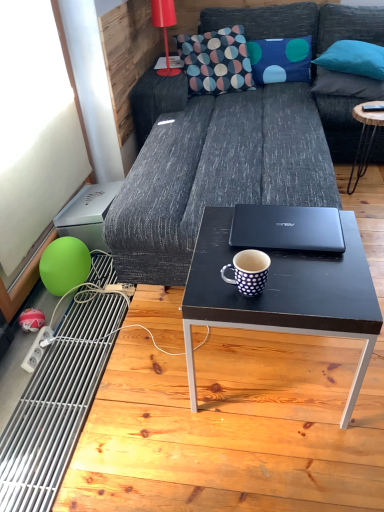
Locate an element on the screen. vacant area that lies in front of white dotted ceramic mug at center is located at coordinates (255, 306).